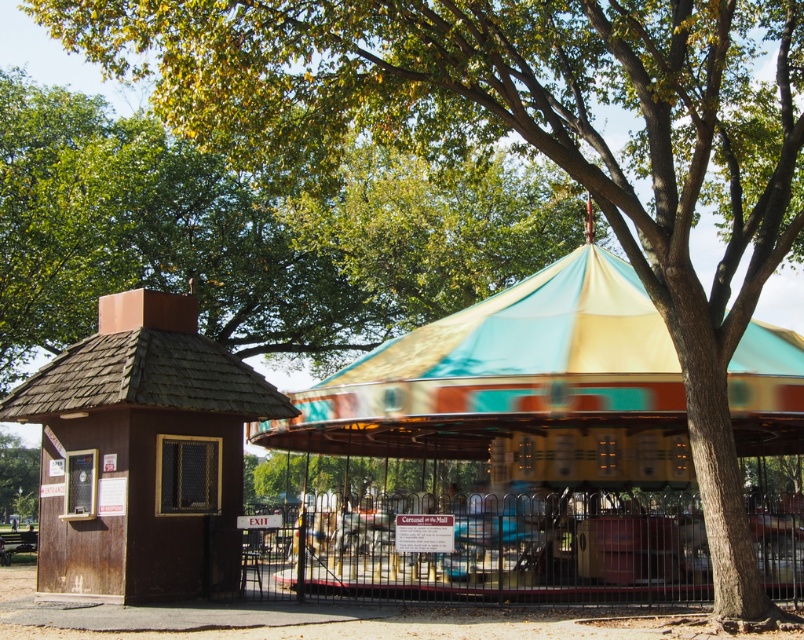
Question: Can you confirm if multicolored fabric carousel at center is positioned to the left of brown wood gazebo at left?

Choices:
 (A) no
 (B) yes

Answer: (A)

Question: Which object appears closest to the camera in this image?

Choices:
 (A) multicolored fabric carousel at center
 (B) brown wood gazebo at left

Answer: (A)

Question: Does multicolored fabric carousel at center have a smaller size compared to brown wood gazebo at left?

Choices:
 (A) no
 (B) yes

Answer: (A)

Question: Can you confirm if multicolored fabric carousel at center is bigger than brown wood gazebo at left?

Choices:
 (A) yes
 (B) no

Answer: (A)